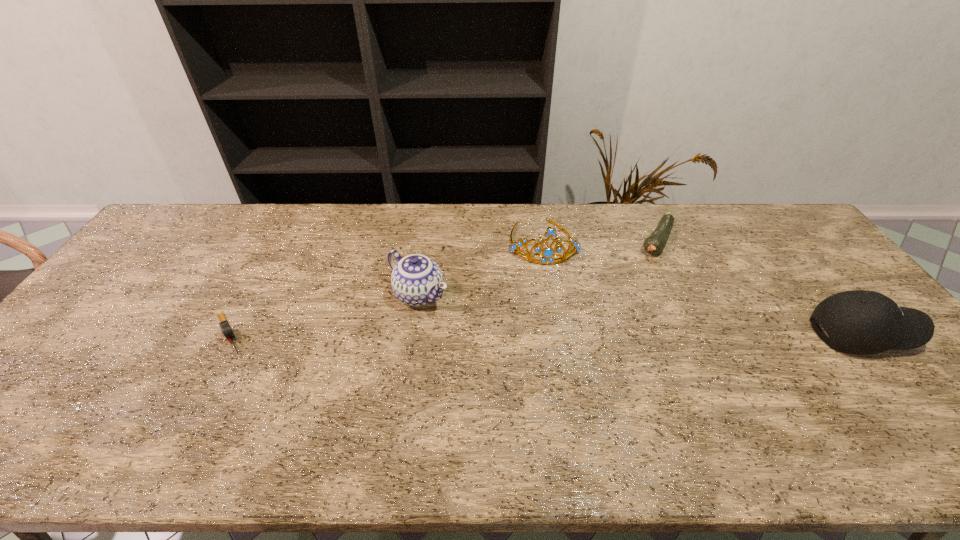
You are a GUI agent. You are given a task and a screenshot of the screen. Output one action in this format:
    pyautogui.click(x=<x>, y=<y>)
    Task: Click on the blank region between the baseball cap and the tape measure
    This screenshot has width=960, height=540.
    Given the screenshot: What is the action you would take?
    pyautogui.click(x=546, y=334)

This screenshot has height=540, width=960. Find the location of `free space between the chinaware and the fourth object from left to right`. free space between the chinaware and the fourth object from left to right is located at coordinates coord(538,268).

Identify which object is located as the nearest to the third object from left to right. Please provide its 2D coordinates. Your answer should be formatted as a tuple, i.e. [(x, y)], where the tuple contains the x and y coordinates of a point satisfying the conditions above.

[(416, 280)]

You are a GUI agent. You are given a task and a screenshot of the screen. Output one action in this format:
    pyautogui.click(x=<x>, y=<y>)
    Task: Click on the closest object to the leftmost object
    The width and height of the screenshot is (960, 540).
    Given the screenshot: What is the action you would take?
    pyautogui.click(x=416, y=280)

The width and height of the screenshot is (960, 540). What are the coordinates of `vacant region that satisfies the following two spatial constraints: 1. on the front side of the fourth object from right to left; 2. on the front-facing side of the baseball cap` in the screenshot? It's located at (414, 334).

Identify the location of free space that satisfies the following two spatial constraints: 1. on the back side of the baseball cap; 2. on the front-facing side of the tape measure. (229, 334).

Find the location of a particular element. Image resolution: width=960 pixels, height=540 pixels. vacant space that satisfies the following two spatial constraints: 1. on the front side of the second shortest object; 2. on the front-facing side of the rightmost object is located at coordinates (701, 334).

In order to click on free space that satisfies the following two spatial constraints: 1. on the back side of the chinaware; 2. on the left side of the third object from right to left in this screenshot , I will do `click(426, 242)`.

You are a GUI agent. You are given a task and a screenshot of the screen. Output one action in this format:
    pyautogui.click(x=<x>, y=<y>)
    Task: Click on the vacant space that satisfies the following two spatial constraints: 1. on the front side of the rightmost object; 2. on the front-facing side of the fourth tallest object
    Image resolution: width=960 pixels, height=540 pixels.
    Given the screenshot: What is the action you would take?
    pyautogui.click(x=701, y=334)